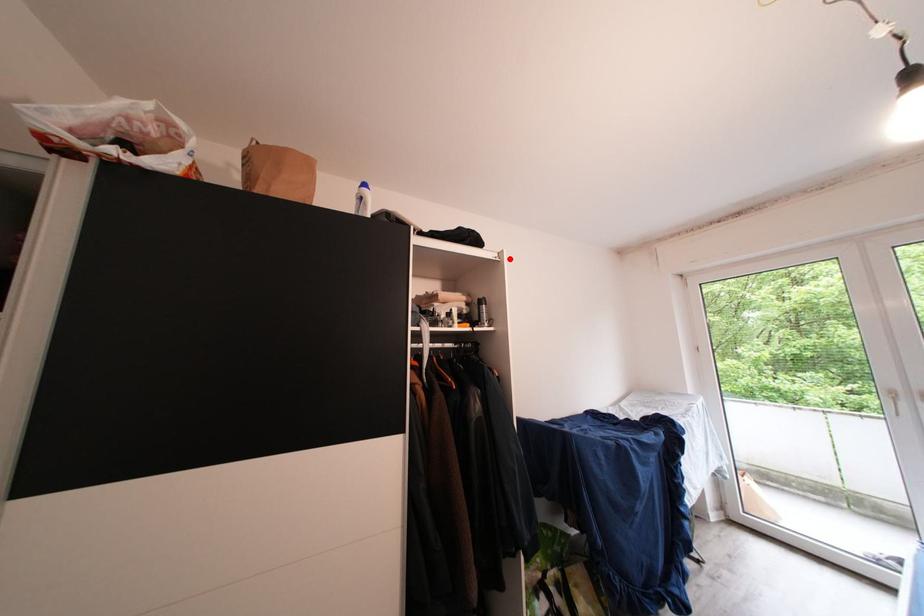
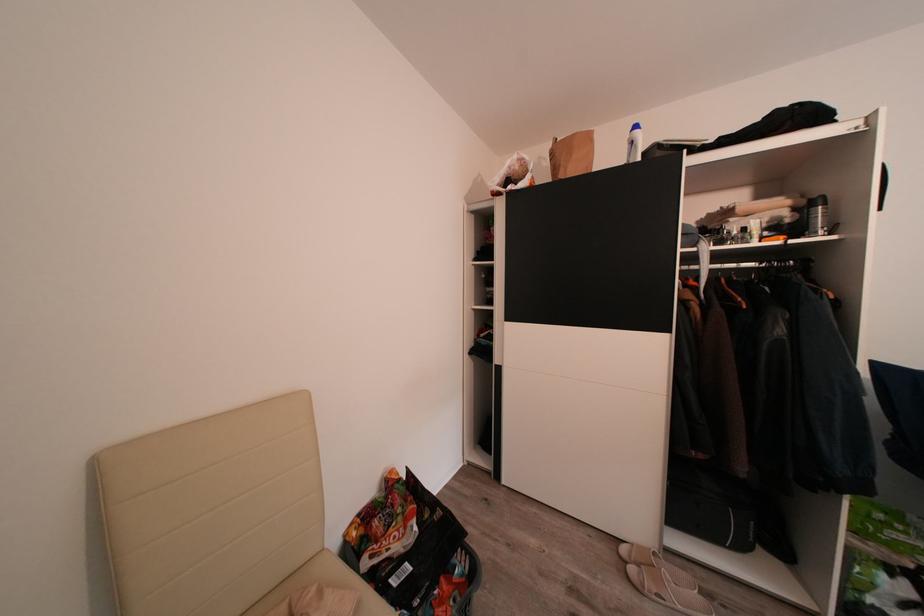
Locate, in the second image, the point that corresponds to the highlighted location in the first image.

(881, 122)